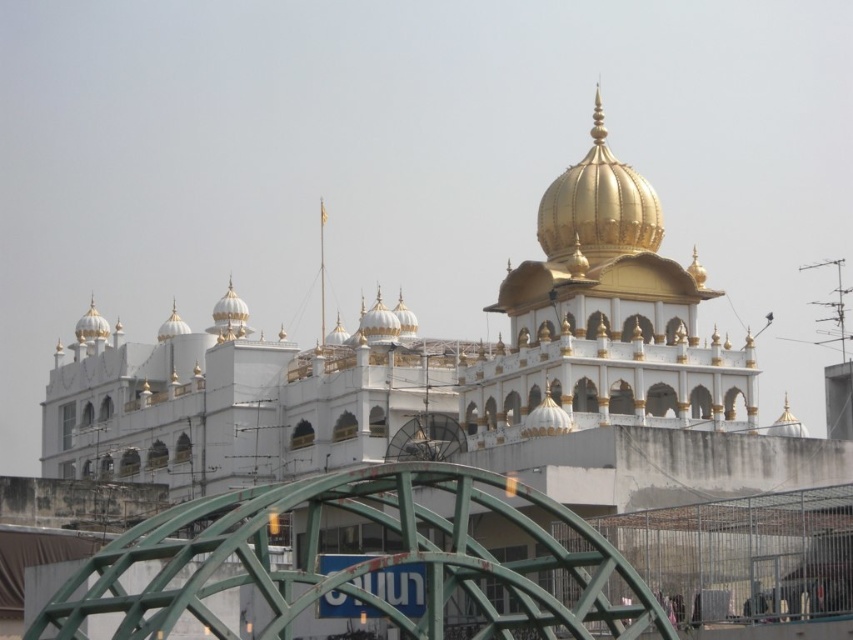
Is green metallic bridge at lower center closer to camera compared to gold polished dome at center?

Yes, it is.

Between green metallic bridge at lower center and gold polished dome at center, which one has more height?

green metallic bridge at lower center

What do you see at coordinates (366, 563) in the screenshot?
I see `green metallic bridge at lower center` at bounding box center [366, 563].

At what (x,y) coordinates should I click in order to perform the action: click on green metallic bridge at lower center. Please return your answer as a coordinate pair (x, y). The width and height of the screenshot is (853, 640). Looking at the image, I should click on (366, 563).